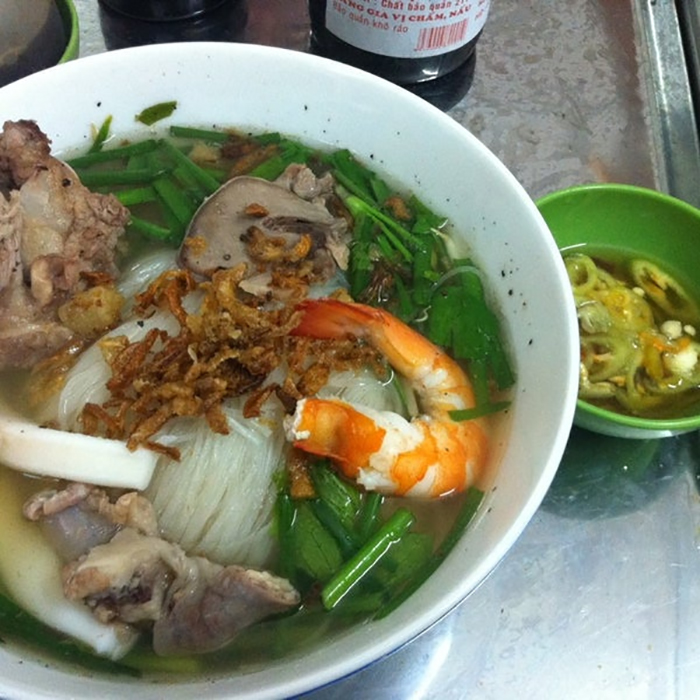
In order to click on metal table in this screenshot , I will do `click(570, 631)`.